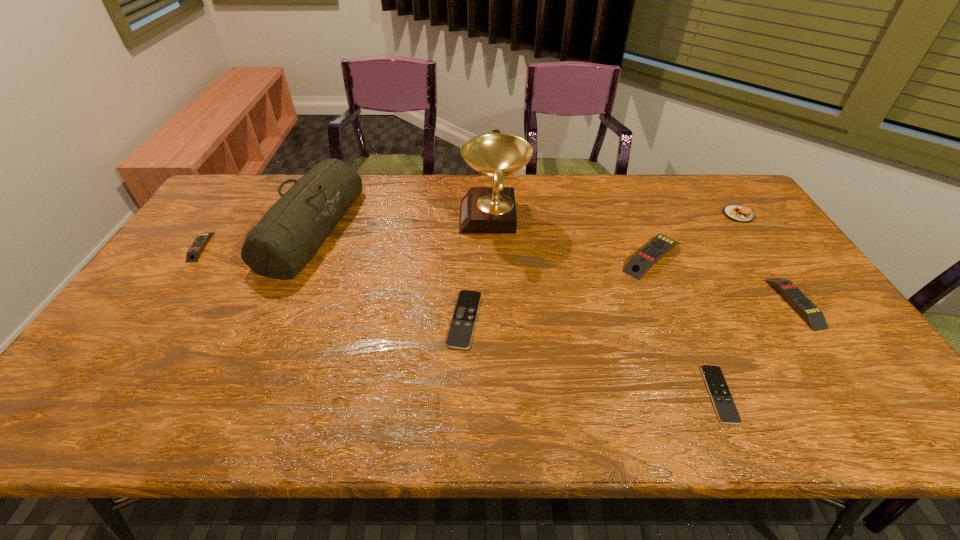
Identify which remote control is the fifth nearest to the sixth shortest object. Please provide its 2D coordinates. Your answer should be formatted as a tuple, i.e. [(x, y)], where the tuple contains the x and y coordinates of a point satisfying the conditions above.

[(193, 254)]

I want to click on yellow remote control that is the closest to the smallest yellow remote control, so click(x=651, y=253).

Identify the location of the second closest yellow remote control to the fifth tallest object. The height and width of the screenshot is (540, 960). (193, 254).

At what (x,y) coordinates should I click in order to perform the action: click on free spot that satisfies the following two spatial constraints: 1. on the front side of the fourth tallest object; 2. on the left side of the second biggest yellow remote control. Please return your answer as a coordinate pair (x, y). Looking at the image, I should click on (672, 303).

This screenshot has width=960, height=540. I want to click on blank area in the image that satisfies the following two spatial constraints: 1. on the front-facing side of the second tallest remote control; 2. on the right side of the award, so click(497, 303).

The width and height of the screenshot is (960, 540). I want to click on vacant space that satisfies the following two spatial constraints: 1. on the front-facing side of the tallest object; 2. on the right side of the fourth shortest remote control, so click(497, 303).

This screenshot has width=960, height=540. I want to click on blank space that satisfies the following two spatial constraints: 1. on the front side of the shortest remote control; 2. on the right side of the tallest remote control, so click(710, 394).

Locate an element on the screen. The height and width of the screenshot is (540, 960). free spot that satisfies the following two spatial constraints: 1. on the front-facing side of the shortest object; 2. on the right side of the tallest object is located at coordinates (500, 394).

I want to click on blank area in the image that satisfies the following two spatial constraints: 1. on the front side of the seventh object from right to left; 2. on the left side of the nearer black remote control, so click(x=238, y=394).